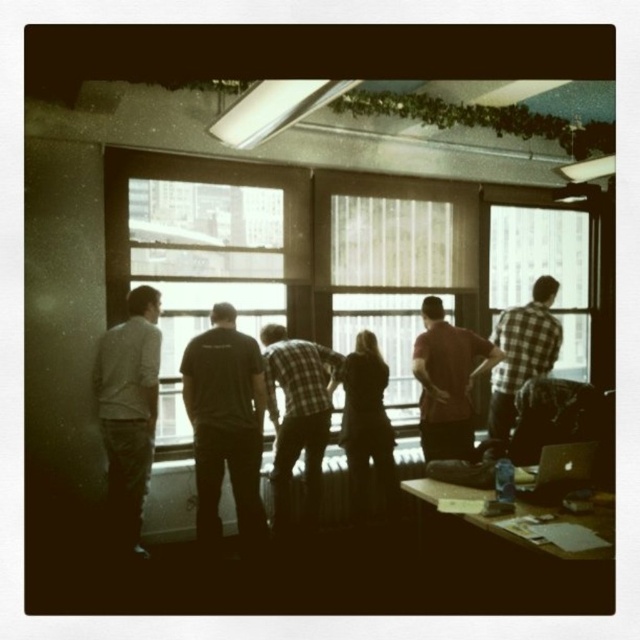
Question: Among these objects, which one is nearest to the camera?

Choices:
 (A) satin silver laptop at lower right
 (B) plaid fabric shirt at center
 (C) checkered fabric shirt at right

Answer: (A)

Question: Estimate the real-world distances between objects in this image. Which object is closer to the satin silver laptop at lower right?

Choices:
 (A) matte red shirt at center
 (B) checkered fabric shirt at right
 (C) clear glass window at center
 (D) plaid fabric shirt at center

Answer: (A)

Question: In this image, where is plaid fabric shirt at center located relative to satin silver laptop at lower right?

Choices:
 (A) left
 (B) right

Answer: (A)

Question: Which object is the farthest from the satin silver laptop at lower right?

Choices:
 (A) black cotton shirt at center
 (B) plaid fabric shirt at center
 (C) matte red shirt at center

Answer: (A)

Question: Can you confirm if black cotton shirt at center is positioned above checkered fabric shirt at right?

Choices:
 (A) yes
 (B) no

Answer: (B)

Question: Is matte red shirt at center below checkered fabric shirt at right?

Choices:
 (A) yes
 (B) no

Answer: (A)